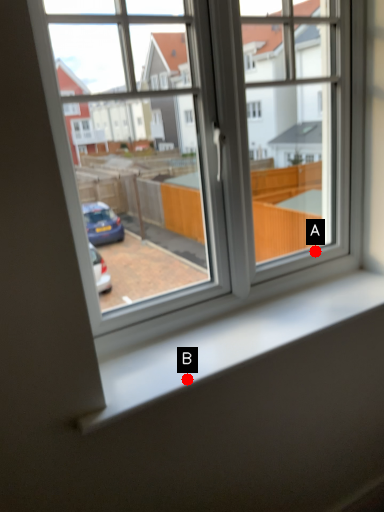
Question: Two points are circled on the image, labeled by A and B beside each circle. Which point is further to the camera?

Choices:
 (A) A is further
 (B) B is further

Answer: (A)